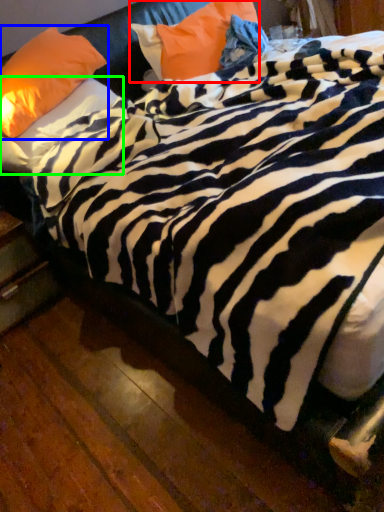
Question: Considering the real-world distances, which object is closest to pillow (highlighted by a red box)? pillow (highlighted by a blue box) or pillow (highlighted by a green box).

Choices:
 (A) pillow
 (B) pillow

Answer: (A)